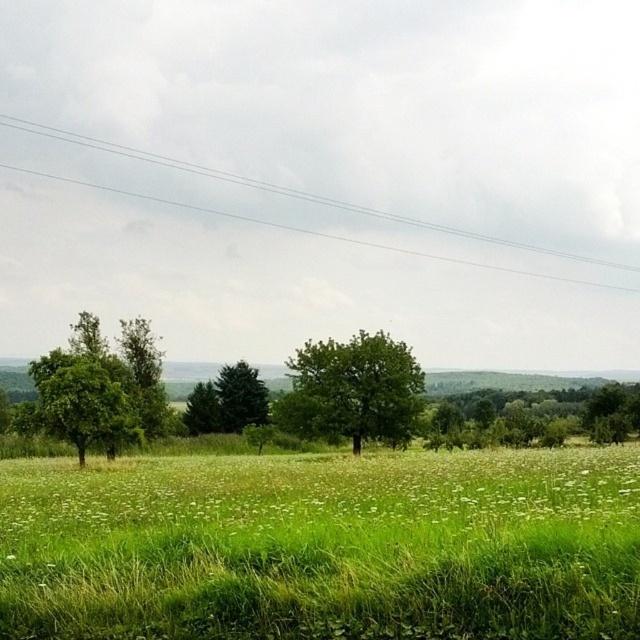
Is green leafy tree at center closer to the viewer compared to green leafy tree at right?

Yes, green leafy tree at center is in front of green leafy tree at right.

Who is more forward, (308, 344) or (563, 413)?

Point (308, 344) is in front.

Where is `green leafy tree at center`? green leafy tree at center is located at coordinates (353, 390).

Is green grass at center above green leafy tree at right?

Correct, green grass at center is located above green leafy tree at right.

Which is behind, point (234, 472) or point (464, 433)?

Point (464, 433)

You are a GUI agent. You are given a task and a screenshot of the screen. Output one action in this format:
    pyautogui.click(x=<x>, y=<y>)
    Task: Click on the green grass at center
    The image size is (640, 640).
    Given the screenshot: What is the action you would take?
    pyautogui.click(x=321, y=490)

Is green leafy tree at left in front of green leafy tree at center?

Yes, it is in front of green leafy tree at center.

What do you see at coordinates (99, 388) in the screenshot?
I see `green leafy tree at left` at bounding box center [99, 388].

Identify the location of green leafy tree at left. (99, 388).